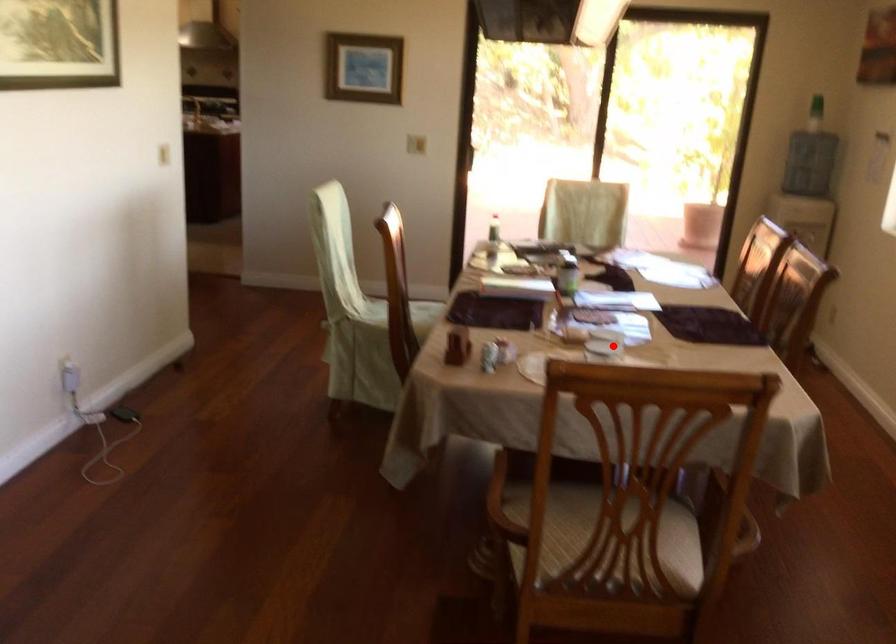
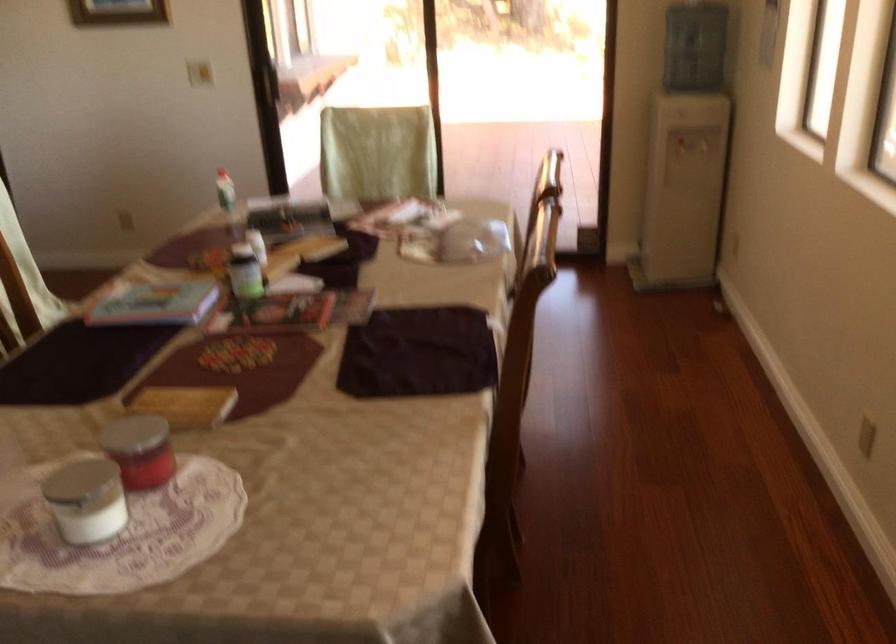
Question: I am providing you with two images of the same scene from different viewpoints. A red point is shown in image1. For the corresponding object point in image2, is it positioned nearer or farther from the camera?

Choices:
 (A) Nearer
 (B) Farther

Answer: (A)